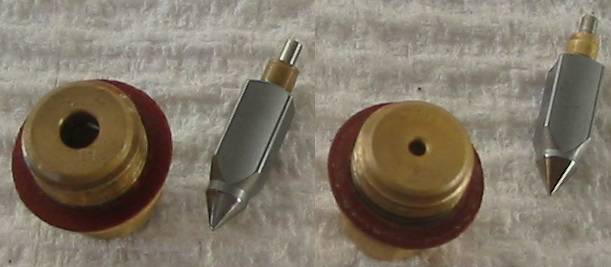
Where is `table under cloth`? table under cloth is located at coordinates (200, 53).